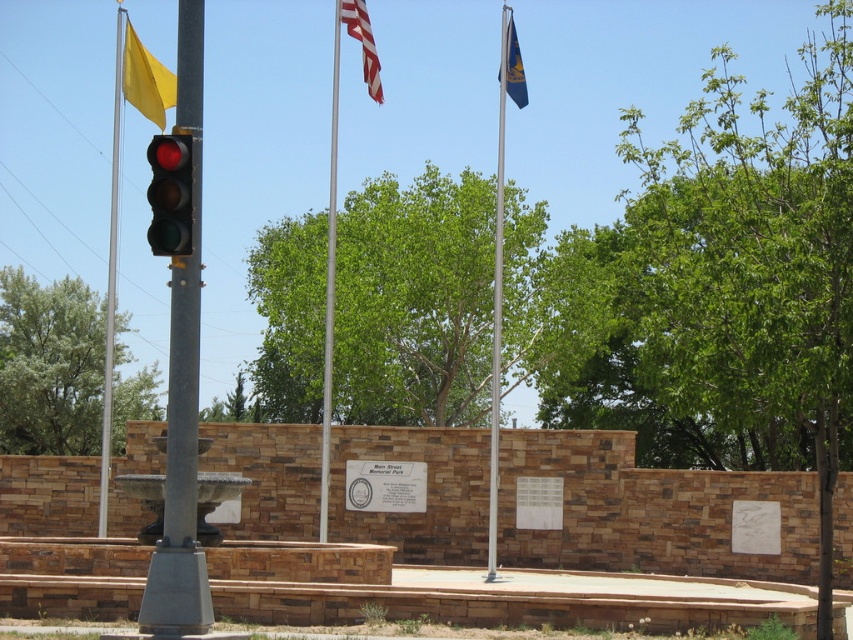
Which is in front, point (114, 157) or point (137, 40)?

Point (137, 40) is in front.

Does yellow flag at left have a lesser height compared to yellow fabric flag at upper left?

No, yellow flag at left is not shorter than yellow fabric flag at upper left.

Is point (115, 275) positioned in front of point (131, 81)?

No, (115, 275) is behind (131, 81).

This screenshot has width=853, height=640. I want to click on yellow flag at left, so click(x=111, y=269).

Can you confirm if metallic flag pole at center is bigger than american flag at upper center?

Yes.

This screenshot has width=853, height=640. Find the location of `metallic flag pole at center`. metallic flag pole at center is located at coordinates (329, 291).

Can you confirm if yellow flag at left is taller than blue fabric flag at upper right?

Indeed, yellow flag at left has a greater height compared to blue fabric flag at upper right.

Is yellow flag at left thinner than blue fabric flag at upper right?

No.

At what (x,y) coordinates should I click in order to perform the action: click on yellow flag at left. Please return your answer as a coordinate pair (x, y). Image resolution: width=853 pixels, height=640 pixels. Looking at the image, I should click on (111, 269).

You are a GUI agent. You are given a task and a screenshot of the screen. Output one action in this format:
    pyautogui.click(x=<x>, y=<y>)
    Task: Click on the yellow flag at left
    Image resolution: width=853 pixels, height=640 pixels.
    Given the screenshot: What is the action you would take?
    pyautogui.click(x=111, y=269)